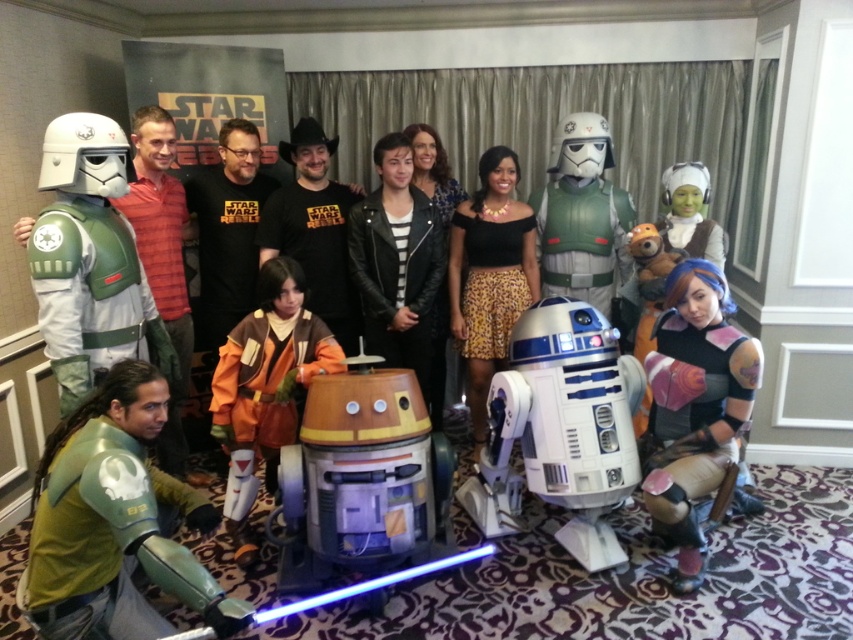
Question: Can you confirm if green fabric costume at center is thinner than green fabric costume at left?

Choices:
 (A) yes
 (B) no

Answer: (B)

Question: Which point appears farthest from the camera in this image?

Choices:
 (A) (84, 140)
 (B) (379, 308)
 (C) (554, 195)

Answer: (C)

Question: Is satin purple armor at lower right positioned before orange fabric costume at center?

Choices:
 (A) no
 (B) yes

Answer: (B)

Question: Does green matte armor at lower left have a lesser width compared to leopard print skirt at center?

Choices:
 (A) no
 (B) yes

Answer: (A)

Question: Which point appears closest to the camera in this image?

Choices:
 (A) (570, 156)
 (B) (483, 330)

Answer: (B)

Question: Among these objects, which one is nearest to the camera?

Choices:
 (A) green plastic stormtrooper at center
 (B) green fabric costume at center
 (C) orange fabric costume at center

Answer: (B)